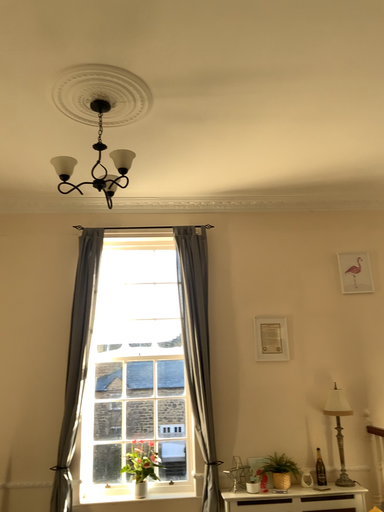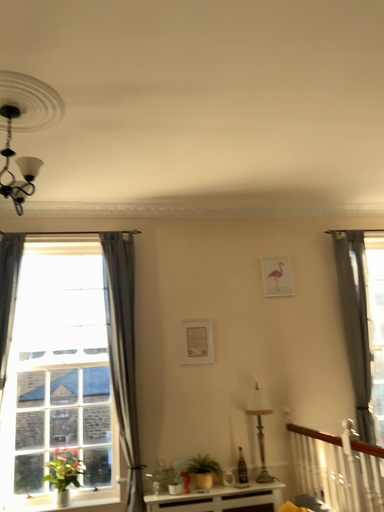
Question: Which way did the camera rotate in the video?

Choices:
 (A) rotated right
 (B) rotated left

Answer: (A)